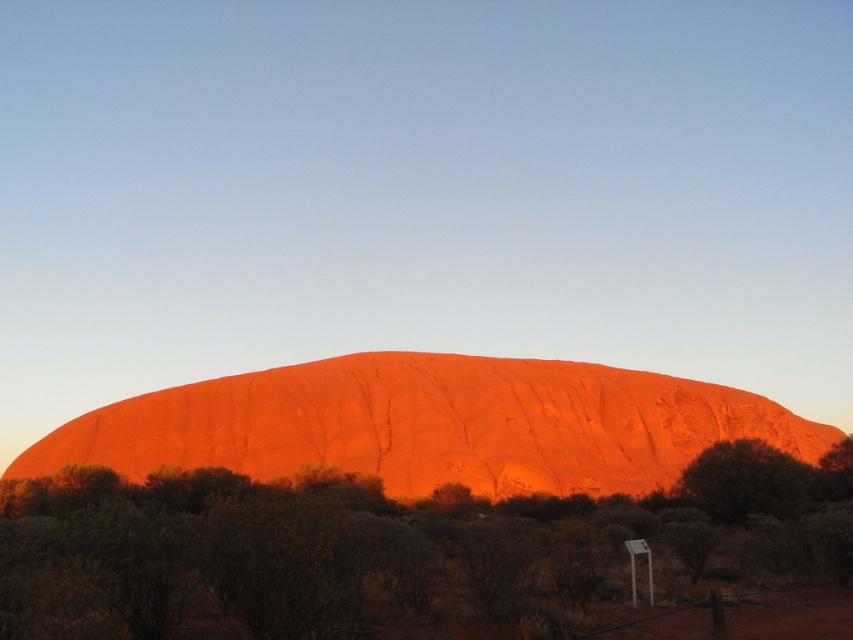
You are a photographer planning to take a wide shot of the matte orange rock at center and the green leafy bush at lower right. Based on their sizes, which object should you focus on first to ensure both are in frame?

The matte orange rock at center is larger than the green leafy bush at lower right, so you should focus on the matte orange rock at center first to ensure both fit within the frame.